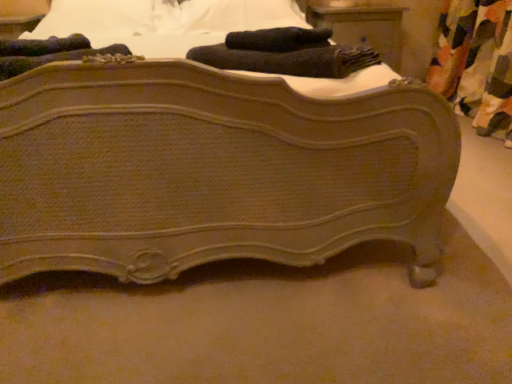
Question: Is matte brown wood nightstand at upper center located outside black soft towel at upper center?

Choices:
 (A) no
 (B) yes

Answer: (B)

Question: Does matte brown wood nightstand at upper center have a smaller size compared to black soft towel at upper center?

Choices:
 (A) no
 (B) yes

Answer: (A)

Question: From a real-world perspective, is matte brown wood nightstand at upper center below black soft towel at upper center?

Choices:
 (A) yes
 (B) no

Answer: (A)

Question: From the image's perspective, does matte brown wood nightstand at upper center appear lower than black soft towel at upper center?

Choices:
 (A) no
 (B) yes

Answer: (A)

Question: From the image's perspective, is matte brown wood nightstand at upper center over black soft towel at upper center?

Choices:
 (A) yes
 (B) no

Answer: (A)

Question: Based on their sizes in the image, would you say black soft towel at upper center is bigger or smaller than multicolored fabric curtain at right?

Choices:
 (A) big
 (B) small

Answer: (B)

Question: From the image's perspective, is black soft towel at upper center located above or below multicolored fabric curtain at right?

Choices:
 (A) above
 (B) below

Answer: (B)

Question: Visually, is black soft towel at upper center positioned to the left or to the right of multicolored fabric curtain at right?

Choices:
 (A) right
 (B) left

Answer: (B)

Question: From a real-world perspective, is black soft towel at upper center positioned above or below multicolored fabric curtain at right?

Choices:
 (A) below
 (B) above

Answer: (B)

Question: Relative to matte brown wooden bed at center, is multicolored fabric curtain at right in front or behind?

Choices:
 (A) behind
 (B) front

Answer: (A)

Question: Is multicolored fabric curtain at right bigger or smaller than matte brown wooden bed at center?

Choices:
 (A) big
 (B) small

Answer: (B)

Question: From a real-world perspective, relative to matte brown wooden bed at center, is multicolored fabric curtain at right vertically above or below?

Choices:
 (A) above
 (B) below

Answer: (B)

Question: From their relative heights in the image, would you say multicolored fabric curtain at right is taller or shorter than matte brown wooden bed at center?

Choices:
 (A) tall
 (B) short

Answer: (B)

Question: Based on their positions, is black soft towel at upper center located to the left or right of matte brown wood nightstand at upper center?

Choices:
 (A) right
 (B) left

Answer: (B)

Question: Considering the positions of black soft towel at upper center and matte brown wood nightstand at upper center in the image, is black soft towel at upper center wider or thinner than matte brown wood nightstand at upper center?

Choices:
 (A) wide
 (B) thin

Answer: (B)